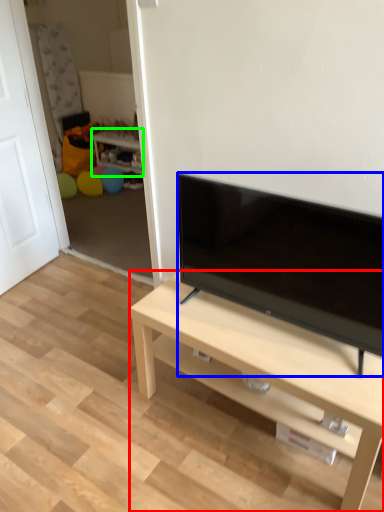
Question: Based on their relative distances, which object is farther from desk (highlighted by a red box)? Choose from television (highlighted by a blue box) and side table (highlighted by a green box).

Choices:
 (A) television
 (B) side table

Answer: (B)